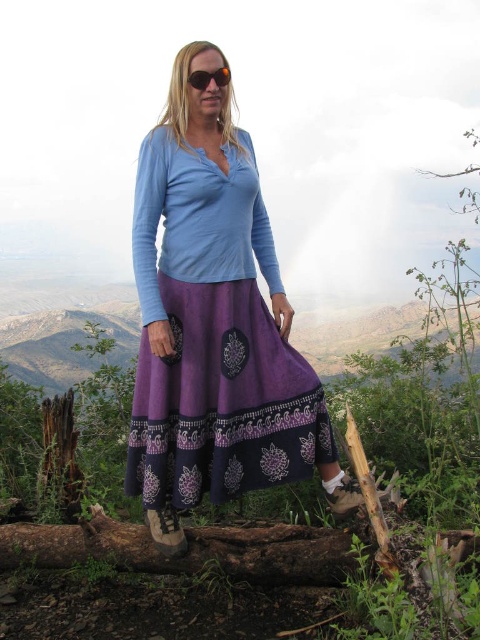
You are a photographer planning to take a portrait of the person wearing the purple skirt. You notice the brown rough log at lower center and the black plastic sunglasses at center. Which object is taller in the image?

The brown rough log at lower center is taller than the black plastic sunglasses at center.

You are an artist sketching the scene. You need to decide which object, the purple cotton skirt at center or the brown rough log at lower center, requires more detailed shading because it is wider. Which one should you focus on?

The brown rough log at lower center requires more detailed shading because it is wider than the purple cotton skirt at center.

You are a photographer wanting to capture the purple cotton skirt at center and the black plastic sunglasses at center in a single frame. Given that the camera has a fixed focal length, which object should you focus on to ensure both are in focus?

To ensure both the purple cotton skirt at center and the black plastic sunglasses at center are in focus, focus on the purple cotton skirt at center since it is larger and likely closer to the camera than the black plastic sunglasses at center.